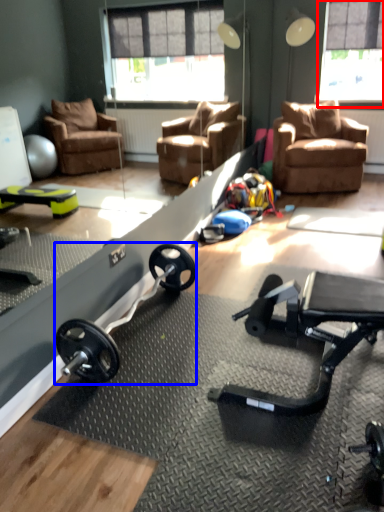
Question: Which point is further to the camera, window screen (highlighted by a red box) or barbell (highlighted by a blue box)?

Choices:
 (A) window screen
 (B) barbell

Answer: (A)